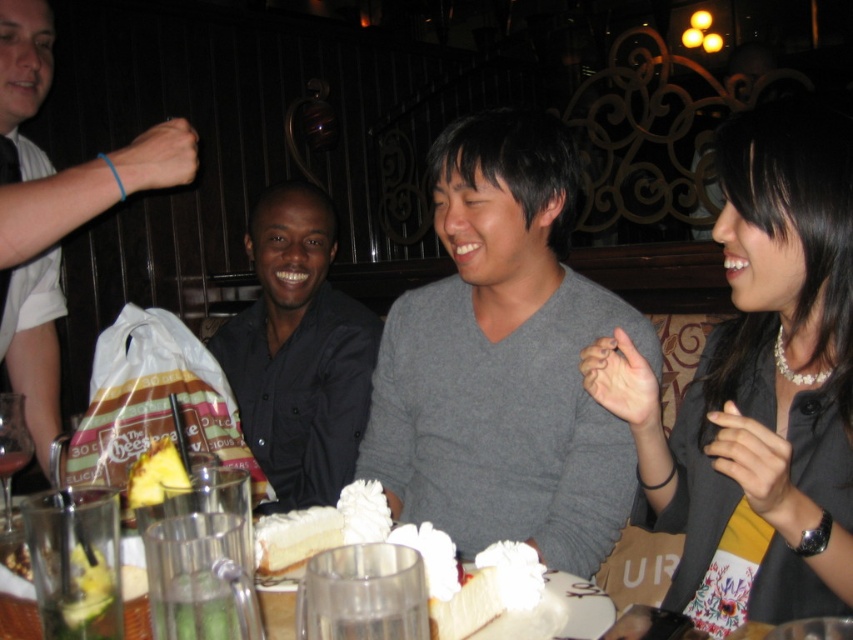
Is pearl necklace at upper right further to the viewer compared to white shirt at left?

No, it is in front of white shirt at left.

Is pearl necklace at upper right above white shirt at left?

Actually, pearl necklace at upper right is below white shirt at left.

What do you see at coordinates (759, 387) in the screenshot? The image size is (853, 640). I see `pearl necklace at upper right` at bounding box center [759, 387].

Where is `pearl necklace at upper right`? pearl necklace at upper right is located at coordinates (759, 387).

Can you confirm if pearl necklace at upper right is positioned below black matte shirt at center?

Yes.

Who is shorter, pearl necklace at upper right or black matte shirt at center?

pearl necklace at upper right is shorter.

Which is behind, point (674, 452) or point (289, 248)?

Point (289, 248)

Identify the location of pearl necklace at upper right. (759, 387).

Is black matte shirt at center to the left of yellow pineapple at center from the viewer's perspective?

Correct, you'll find black matte shirt at center to the left of yellow pineapple at center.

Who is lower down, black matte shirt at center or yellow pineapple at center?

Positioned lower is yellow pineapple at center.

Is point (230, 371) in front of point (160, 456)?

No, it is not.

Find the location of `black matte shirt at center`. black matte shirt at center is located at coordinates (299, 352).